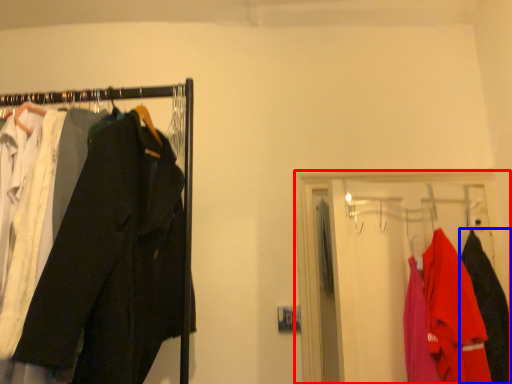
Question: Which point is further to the camera, closet (highlighted by a red box) or clothing (highlighted by a blue box)?

Choices:
 (A) closet
 (B) clothing

Answer: (B)